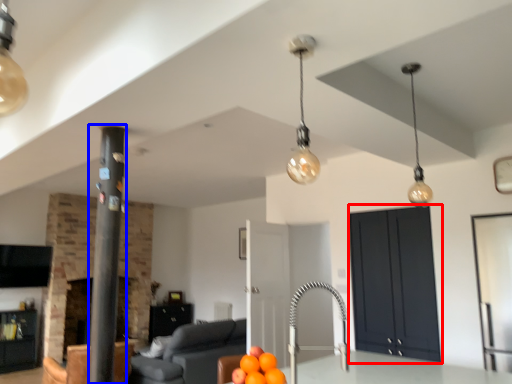
Question: Which object appears farthest to the camera in this image, cabinetry (highlighted by a red box) or pillar (highlighted by a blue box)?

Choices:
 (A) cabinetry
 (B) pillar

Answer: (A)